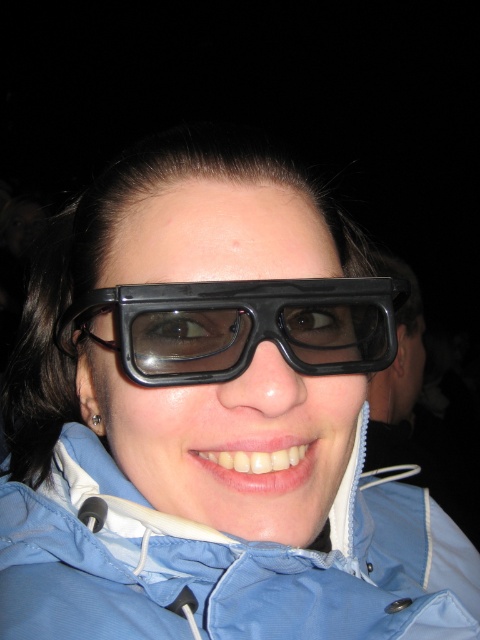
In the scene shown: You are a photographer trying to capture the blue fabric jacket at lower center. You need to position your camera at a specific coordinate to frame the jacket perfectly. According to the image data, what are the exact coordinates where the jacket is located?

The blue fabric jacket at lower center is located at the 2D coordinates of point (227, 563).

Consider the image. You are a photographer standing 30 centimeters away from the blue fabric jacket at lower center. Can you safely step closer to take a better photo without violating the minimum distance requirement of 30 centimeters?

The blue fabric jacket at lower center and viewer are 32.68 centimeters apart from each other. Since you are already 30 centimeters away, stepping closer would bring you within the minimum distance requirement of 30 centimeters, so you cannot step closer safely.

You are a photographer trying to capture a closeup of the black plastic goggles at center without including the blue fabric jacket at lower center in the frame. Is this possible given their positions?

The blue fabric jacket at lower center is taller than black plastic goggles at center, so the jacket may block the view of the goggles. It might be difficult to capture the goggles without including the jacket in the frame.